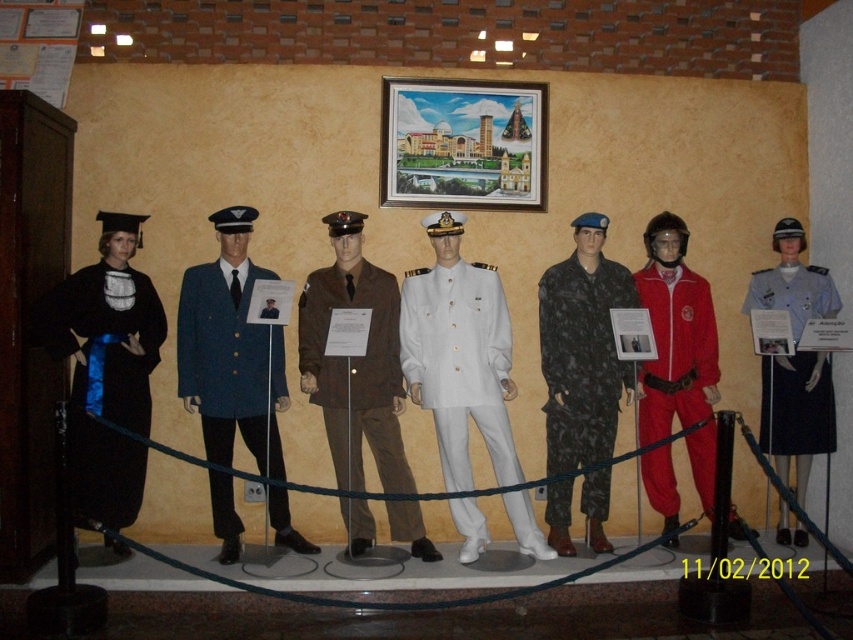
Question: Estimate the real-world distances between objects in this image. Which object is farther from the blue woolen coat at center?

Choices:
 (A) brown woolen coat at center
 (B) matte red jumpsuit at center

Answer: (B)

Question: Does brown woolen coat at center appear on the left side of white fabric uniform at center?

Choices:
 (A) no
 (B) yes

Answer: (B)

Question: Which of the following is the farthest from the observer?

Choices:
 (A) matte red jumpsuit at center
 (B) camouflage fabric jumpsuit at center

Answer: (A)

Question: Which object is positioned farthest from the white matte uniform at center?

Choices:
 (A) black satin gown at left
 (B) blue woolen coat at center

Answer: (A)

Question: Does brown woolen coat at center appear over matte red jumpsuit at center?

Choices:
 (A) yes
 (B) no

Answer: (B)

Question: In this image, where is black satin gown at left located relative to brown woolen coat at center?

Choices:
 (A) below
 (B) above

Answer: (B)